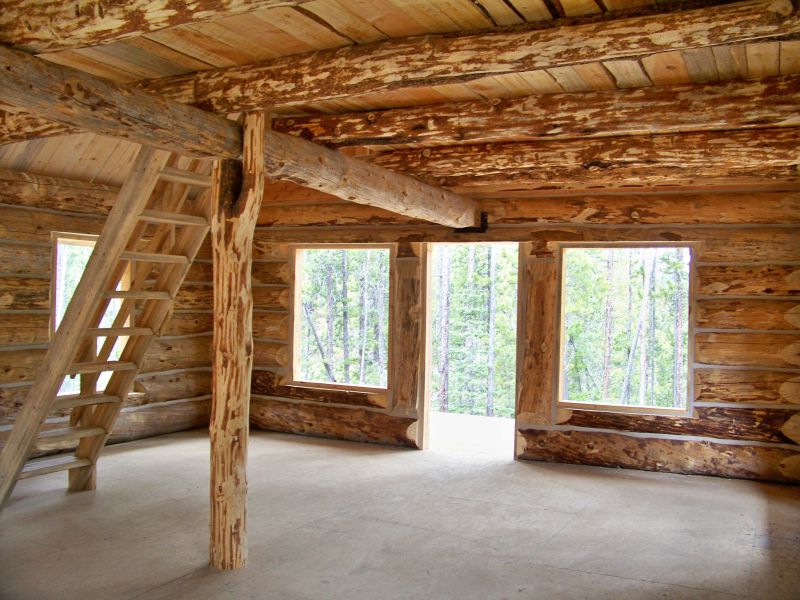
You are a GUI agent. You are given a task and a screenshot of the screen. Output one action in this format:
    pyautogui.click(x=<x>, y=<y>)
    Task: Click on the top of window frame
    This screenshot has width=800, height=600.
    Given the screenshot: What is the action you would take?
    pyautogui.click(x=628, y=245), pyautogui.click(x=337, y=246), pyautogui.click(x=82, y=237)